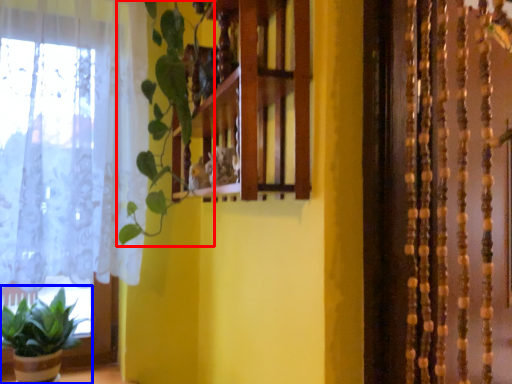
Question: Which object appears farthest to the camera in this image, vegetation (highlighted by a red box) or houseplant (highlighted by a blue box)?

Choices:
 (A) vegetation
 (B) houseplant

Answer: (B)